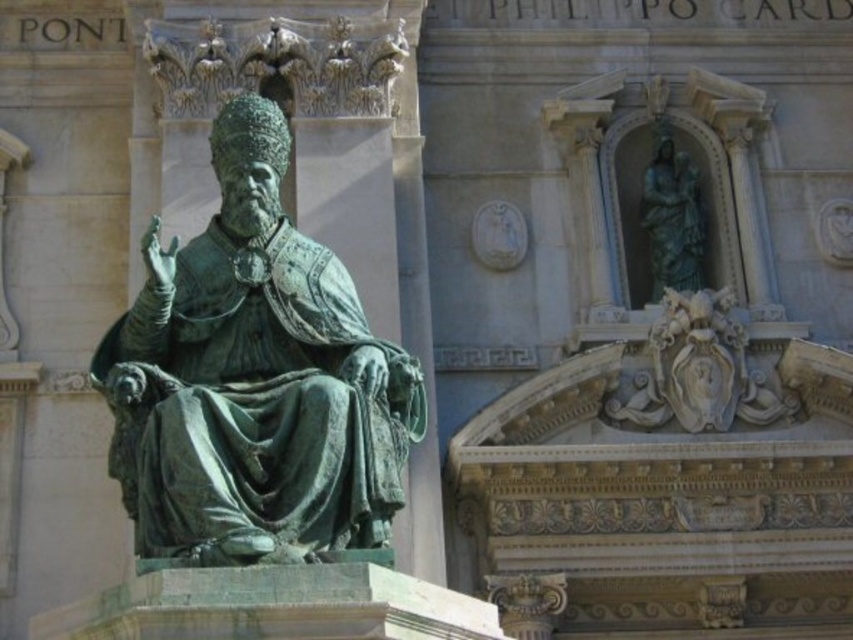
What do you see at coordinates (254, 380) in the screenshot? This screenshot has height=640, width=853. I see `green patina bronze statue at center` at bounding box center [254, 380].

Is point (148, 300) more distant than point (663, 189)?

No, it is not.

The image size is (853, 640). Identify the location of green patina bronze statue at center. (254, 380).

Where is `green patina bronze statue at center`? green patina bronze statue at center is located at coordinates (254, 380).

Can you confirm if white stone ornament at upper center is smaller than green patina statue at upper center?

Yes, white stone ornament at upper center is smaller than green patina statue at upper center.

Which of these two, white stone ornament at upper center or green patina statue at upper center, stands taller?

white stone ornament at upper center is taller.

Is point (648, 385) closer to viewer compared to point (663, 131)?

Yes, point (648, 385) is in front of point (663, 131).

You are a GUI agent. You are given a task and a screenshot of the screen. Output one action in this format:
    pyautogui.click(x=<x>, y=<y>)
    Task: Click on the white stone ornament at upper center
    The height and width of the screenshot is (640, 853).
    Given the screenshot: What is the action you would take?
    pyautogui.click(x=699, y=371)

Which of these two, green patina bronze statue at center or white stone ornament at upper center, stands taller?

Standing taller between the two is green patina bronze statue at center.

Is point (370, 424) closer to camera compared to point (749, 408)?

That is True.

Based on the photo, who is more forward, (259, 234) or (728, 410)?

Point (259, 234)

At what (x,y) coordinates should I click in order to perform the action: click on green patina bronze statue at center. Please return your answer as a coordinate pair (x, y). The width and height of the screenshot is (853, 640). Looking at the image, I should click on (254, 380).